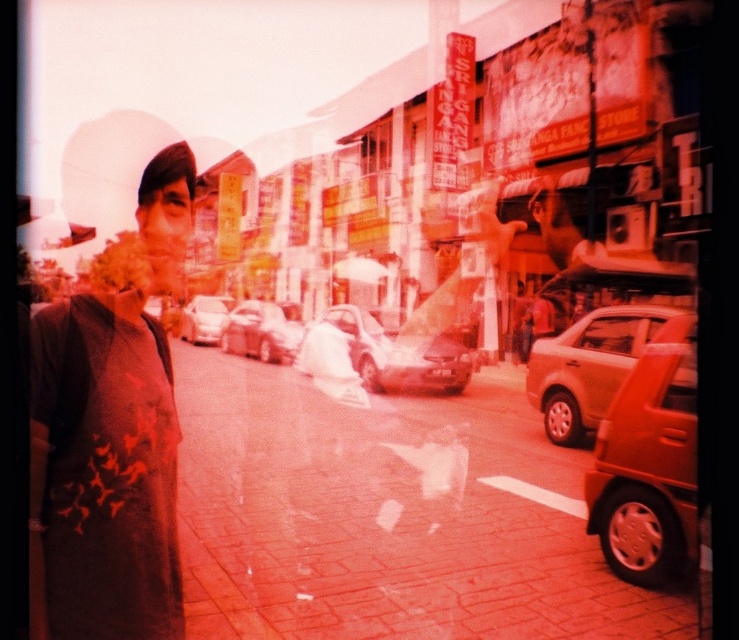
Question: Does brick pavement at center have a lesser width compared to matte gold car at right?

Choices:
 (A) yes
 (B) no

Answer: (B)

Question: Which object appears closest to the camera in this image?

Choices:
 (A) metallic silver car at center
 (B) shiny silver sedan at center

Answer: (A)

Question: Can you confirm if matte gold car at right is positioned below metallic silver car at center?

Choices:
 (A) no
 (B) yes

Answer: (B)

Question: Which point is farther from the camera taking this photo?

Choices:
 (A) (262, 326)
 (B) (341, 324)

Answer: (A)

Question: Where is metallic orange car at right located in relation to matte silver car at center in the image?

Choices:
 (A) right
 (B) left

Answer: (A)

Question: Which of the following is the closest to the observer?

Choices:
 (A) (384, 346)
 (B) (234, 632)
 (C) (647, 305)

Answer: (B)